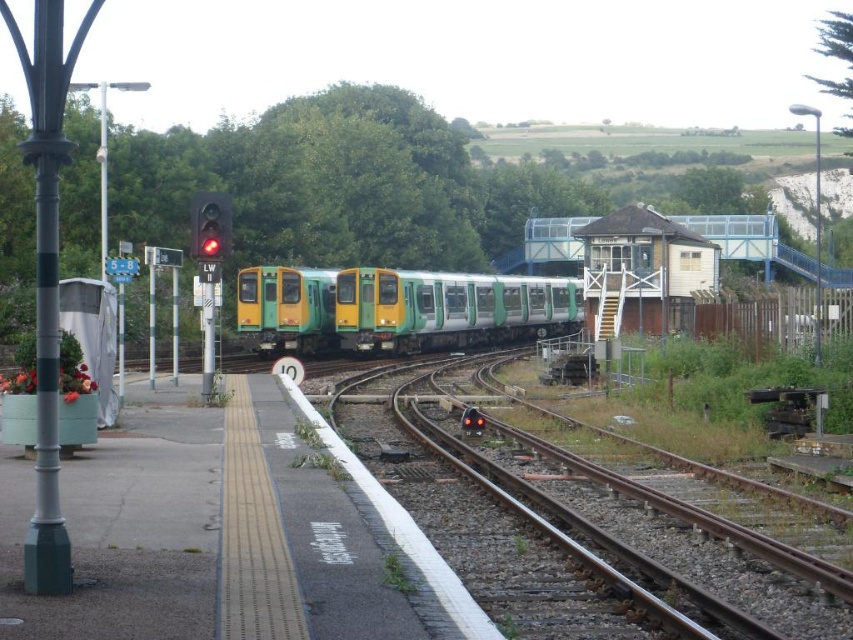
Question: Which object is positioned closest to the red glass traffic light at upper left?

Choices:
 (A) red glass traffic light at center
 (B) metal at center

Answer: (A)

Question: Is green metallic train at center positioned in front of red glass traffic light at center?

Choices:
 (A) yes
 (B) no

Answer: (B)

Question: Among these objects, which one is farthest from the camera?

Choices:
 (A) metal at center
 (B) green metallic train at center
 (C) red glass traffic light at upper left
 (D) red glass traffic light at center

Answer: (B)

Question: In this image, where is metal at center located relative to green metallic train at center?

Choices:
 (A) right
 (B) left

Answer: (A)

Question: Does metal at center appear over green metallic train at center?

Choices:
 (A) no
 (B) yes

Answer: (A)

Question: Which object is the closest to the red glass traffic light at upper left?

Choices:
 (A) red glass traffic light at center
 (B) metal at center
 (C) green metallic train at center

Answer: (A)